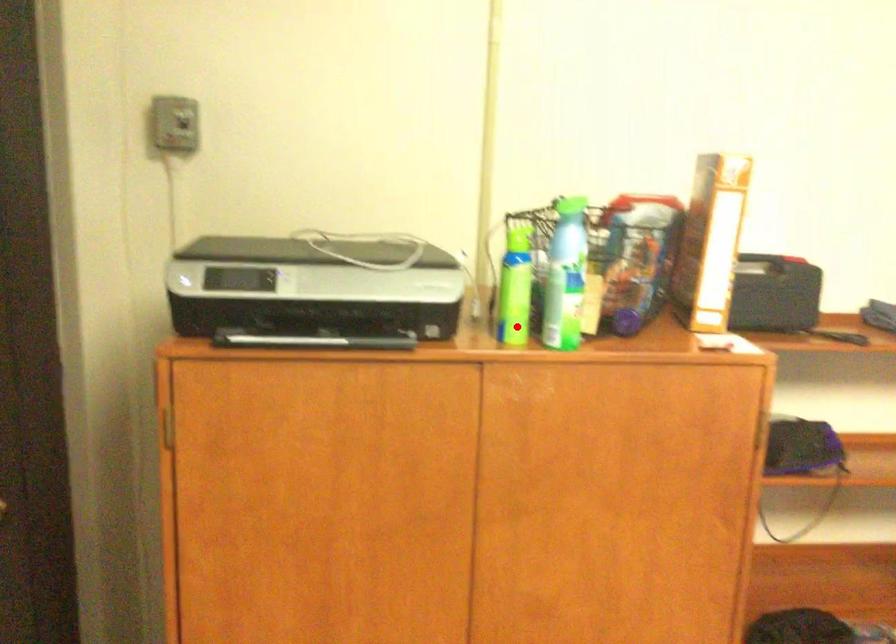
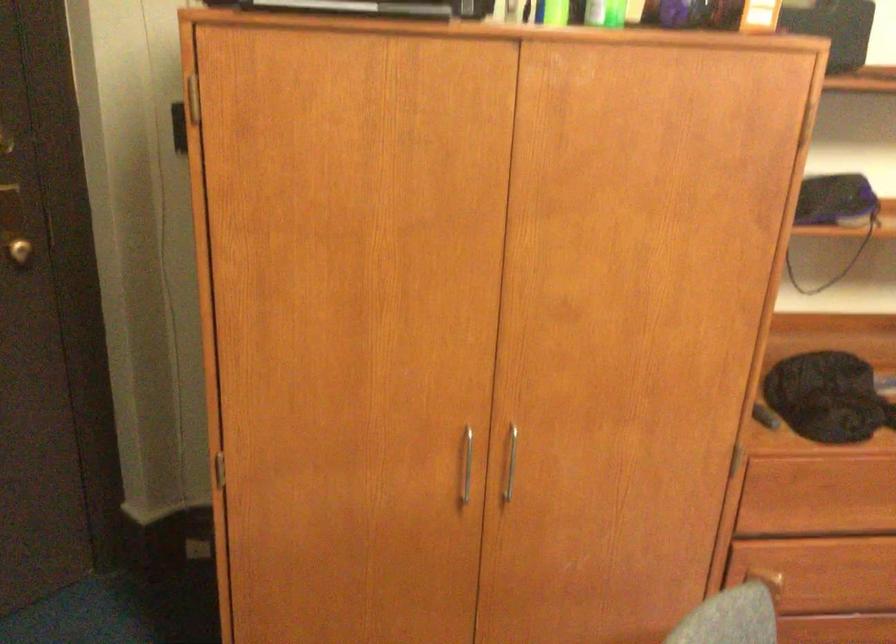
Locate, in the second image, the point that corresponds to the highlighted location in the first image.

(556, 13)